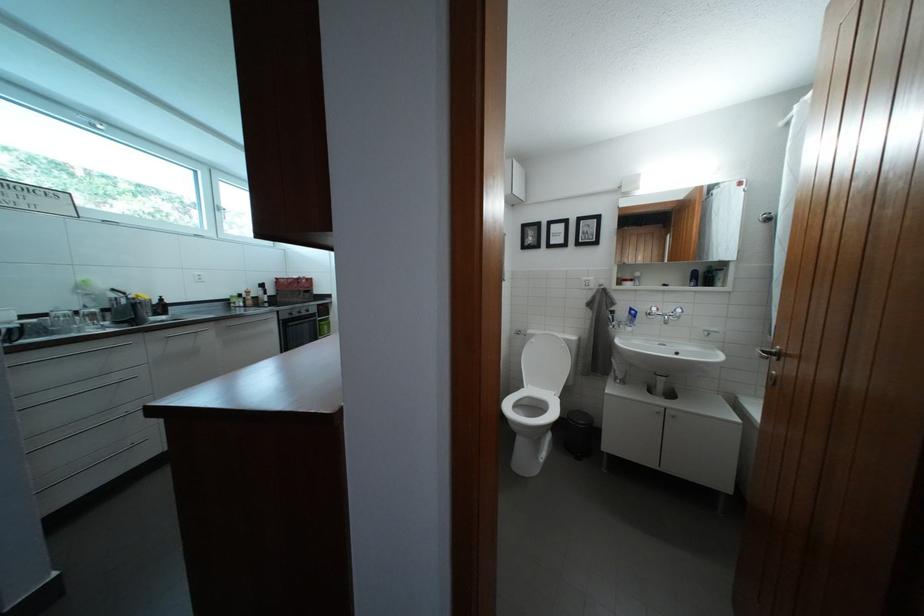
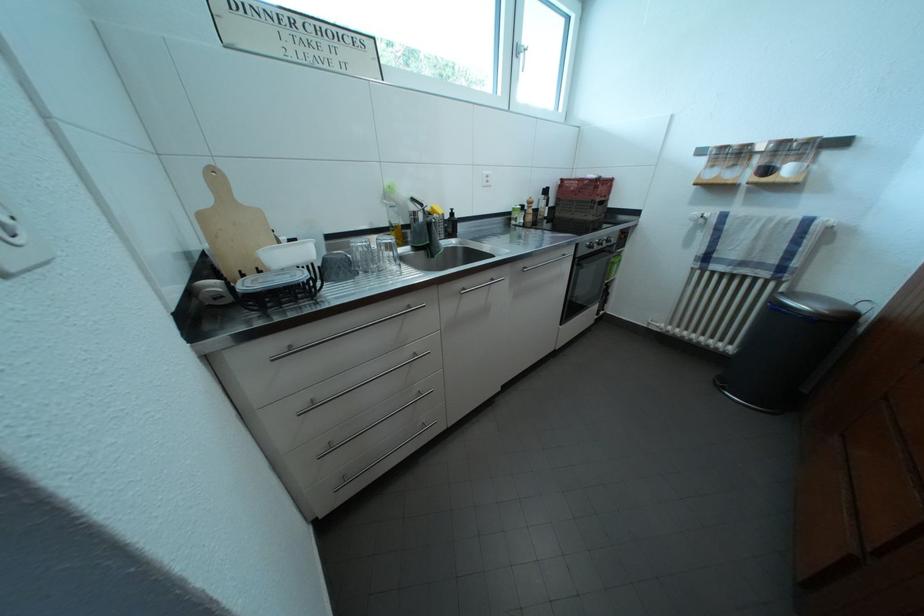
Locate, in the second image, the point that corresponds to point (123, 301) in the first image.

(421, 213)